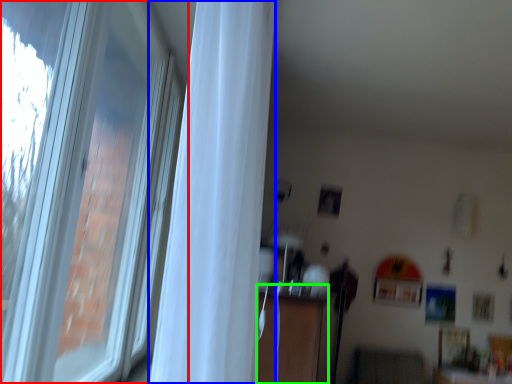
Question: Considering the real-world distances, which object is closest to window (highlighted by a red box)? curtain (highlighted by a blue box) or dresser (highlighted by a green box).

Choices:
 (A) curtain
 (B) dresser

Answer: (B)